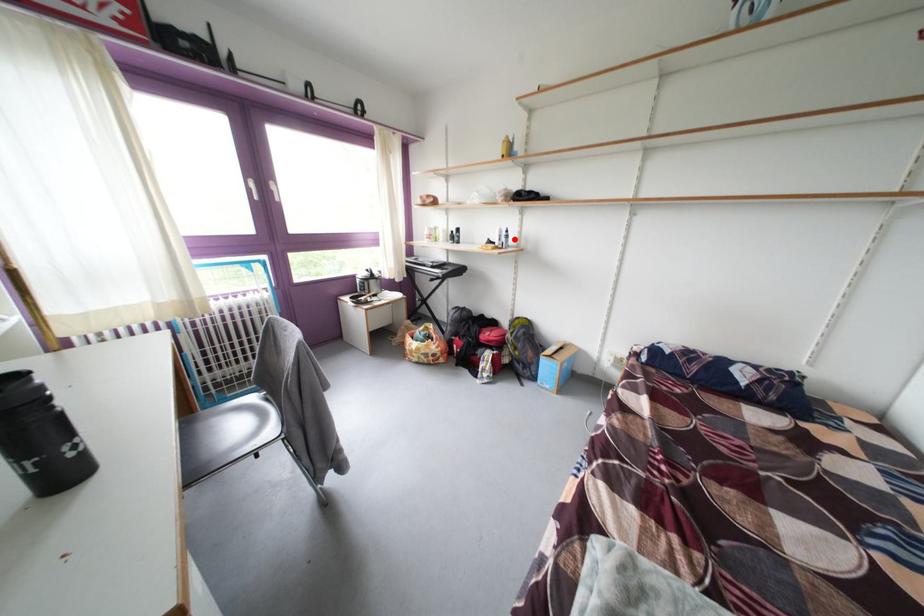
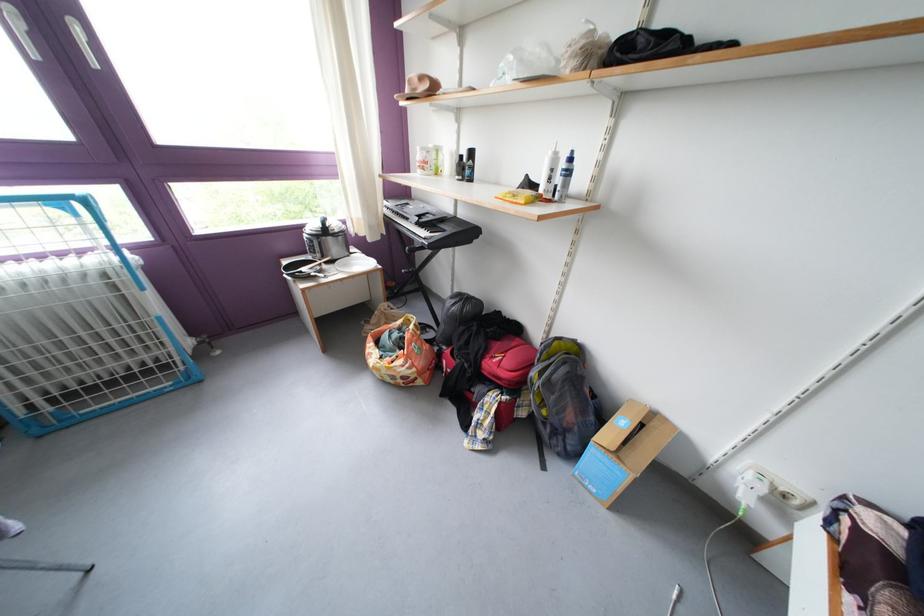
In the second image, find the point that corresponds to the highlighted location in the first image.

(573, 169)